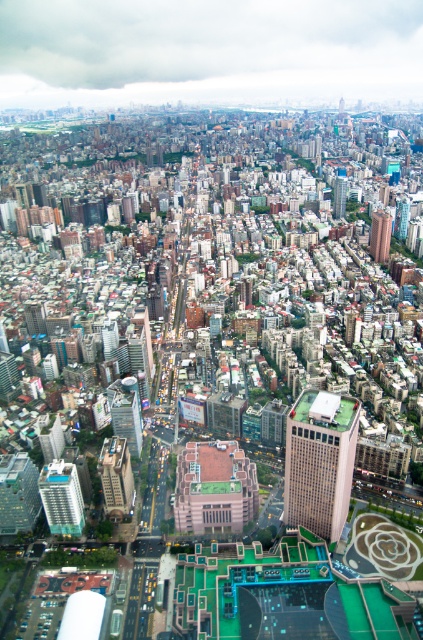
Question: Considering the real-world distances, which object is farthest from the matte glass skyscraper at center-left?

Choices:
 (A) glassy skyscraper at center
 (B) brick red building at upper right
 (C) blue glass skyscraper at center
 (D) matte glass skyscraper at lower left

Answer: (C)

Question: Can you confirm if brick red building at upper right is positioned below blue glass skyscraper at center?

Choices:
 (A) no
 (B) yes

Answer: (B)

Question: Estimate the real-world distances between objects in this image. Which object is farther from the brick red building at upper right?

Choices:
 (A) blue glass skyscraper at center
 (B) glassy skyscraper at center
 (C) matte glass skyscraper at center-left

Answer: (C)

Question: Does matte glass skyscraper at lower left appear over blue glass skyscraper at center?

Choices:
 (A) no
 (B) yes

Answer: (A)

Question: Which point is farther from the camera taking this photo?

Choices:
 (A) (318, 448)
 (B) (126, 420)
 (C) (41, 486)
 (D) (2, 516)

Answer: (B)

Question: Is the position of matte glass skyscraper at lower left less distant than that of brick red building at upper right?

Choices:
 (A) yes
 (B) no

Answer: (A)